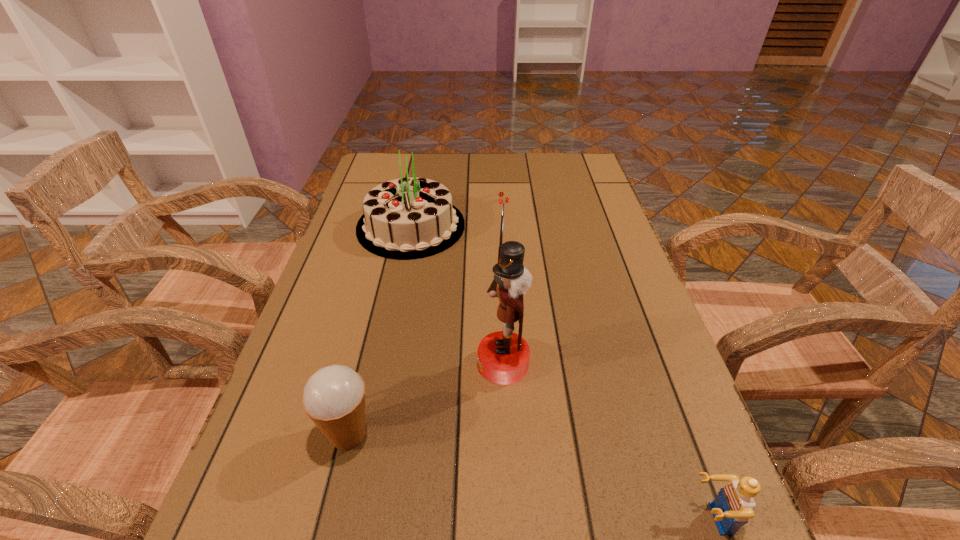
Find the location of a particular element. This screenshot has width=960, height=540. free space between the second farthest object and the icecream is located at coordinates (425, 399).

The height and width of the screenshot is (540, 960). I want to click on free space between the third farthest object and the tallest object, so click(425, 399).

Image resolution: width=960 pixels, height=540 pixels. In order to click on vacant space that is in between the farthest object and the second farthest object in this screenshot , I will do `click(457, 295)`.

Where is `empty space between the nutcracker and the birthday cake`? This screenshot has width=960, height=540. empty space between the nutcracker and the birthday cake is located at coordinates tap(457, 295).

Where is `free spot between the second nearest object and the third nearest object`? The image size is (960, 540). free spot between the second nearest object and the third nearest object is located at coordinates (425, 399).

Select which object appears as the third closest to the nutcracker. Please provide its 2D coordinates. Your answer should be formatted as a tuple, i.e. [(x, y)], where the tuple contains the x and y coordinates of a point satisfying the conditions above.

[(734, 505)]

In order to click on object that is the closest to the nutcracker in this screenshot , I will do `click(334, 397)`.